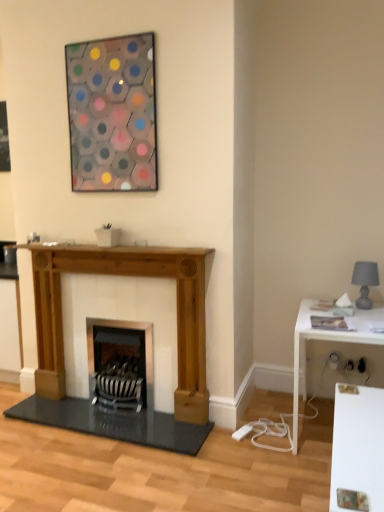
What are the coordinates of `vacant space in front of natural wood fireplace at center` in the screenshot? It's located at (129, 470).